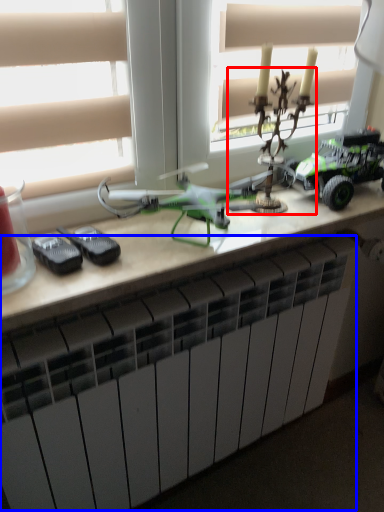
Question: Among these objects, which one is farthest to the camera, toy (highlighted by a red box) or radiator (highlighted by a blue box)?

Choices:
 (A) toy
 (B) radiator

Answer: (A)